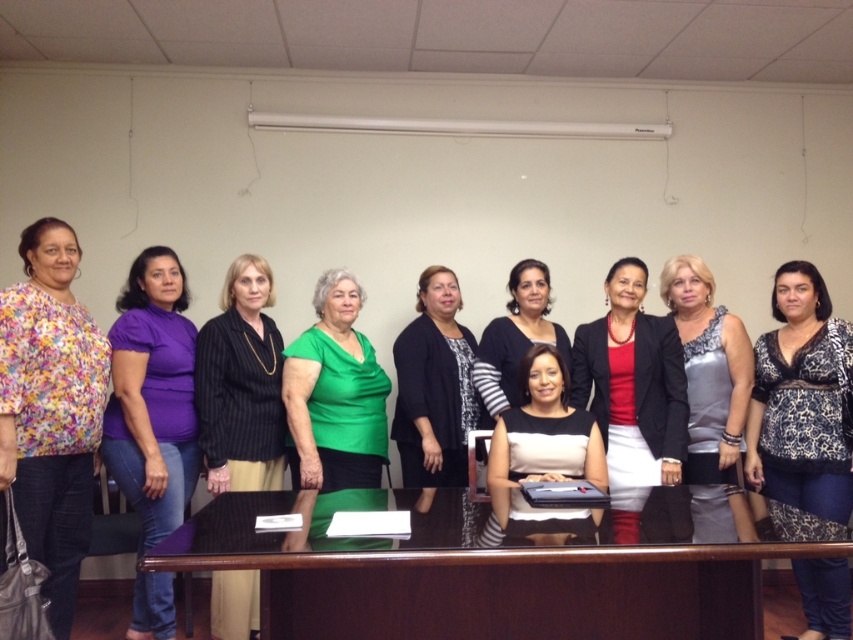
You are organizing a photo shoot and need to arrange the black striped shirt at center and the matte black blouse at center in a specific order. According to the scene, which one is positioned to the left of the other?

The black striped shirt at center is positioned to the left of the matte black blouse at center.

Based on the photo, you are a photographer arranging a group photo. You have two central focal points in the image, the matte red blouse at center and the silver sequined dress at center. Which of these two items has a greater width?

The matte red blouse at center has a greater width than the silver sequined dress at center according to the description.